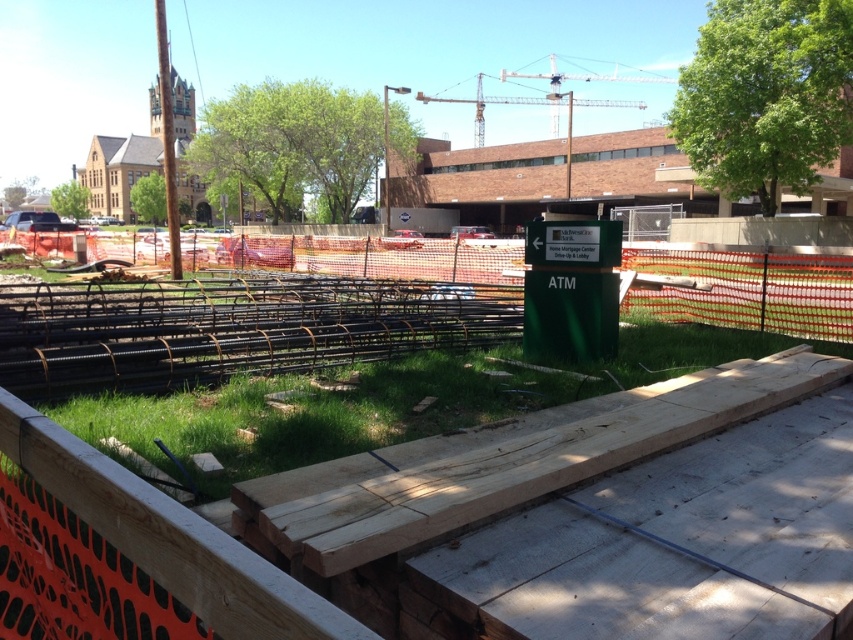
You are a delivery person trying to navigate through a construction site. You see the green grass at center and the orange mesh fence at center. Which one is located to the right side from your perspective?

The green grass at center is located to the right of the orange mesh fence at center.

You are a delivery person who needs to navigate through the construction site. You see the green wood construction at center and the green grass at center. Which one is located to the right side of the other?

The green wood construction at center is to the right of green grass at center.